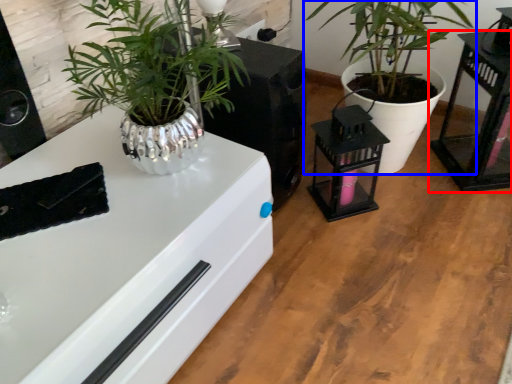
Question: Among these objects, which one is nearest to the camera, table (highlighted by a red box) or houseplant (highlighted by a blue box)?

Choices:
 (A) table
 (B) houseplant

Answer: (B)